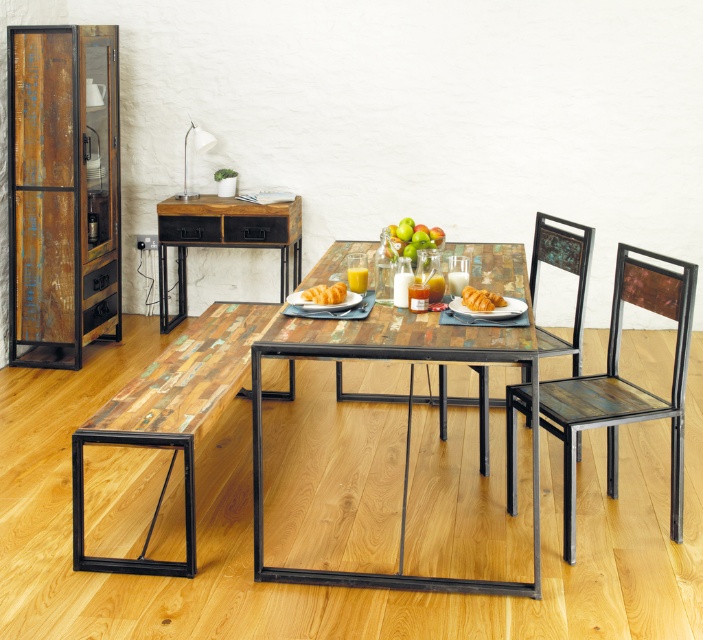
Question: Is woodenmaterial/texturechair at right smaller than green matte apples at center?

Choices:
 (A) yes
 (B) no

Answer: (B)

Question: Among these objects, which one is nearest to the camera?

Choices:
 (A) reclaimed wood desk at center
 (B) woodenmaterial/texturechair at right

Answer: (B)

Question: Can you confirm if multicolored wood table at center is wider than golden brown croissant at center?

Choices:
 (A) yes
 (B) no

Answer: (A)

Question: Considering the real-world distances, which object is farthest from the rustic wood chair at center?

Choices:
 (A) matte wooden platter at center
 (B) woodenmaterial/texturechair at right
 (C) green matte apples at center

Answer: (A)

Question: Is golden flaky croissant at center above golden brown croissant at center?

Choices:
 (A) yes
 (B) no

Answer: (B)

Question: Estimate the real-world distances between objects in this image. Which object is farther from the matte wooden platter at center?

Choices:
 (A) green matte apples at center
 (B) rustic wood chair at center

Answer: (B)